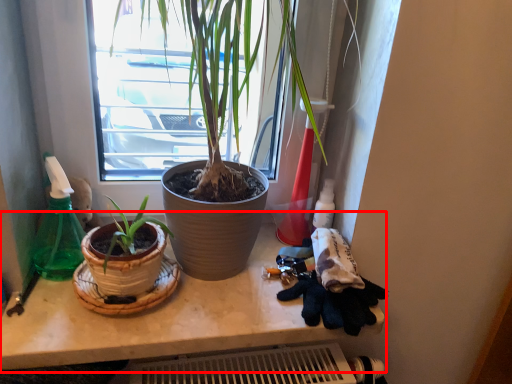
Question: From the image's perspective, where is counter (annotated by the red box) located relative to bottle?

Choices:
 (A) below
 (B) above

Answer: (A)